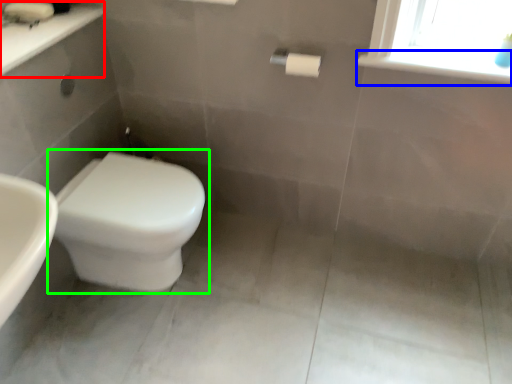
Question: Estimate the real-world distances between objects in this image. Which object is farther from counter top (highlighted by a red box), window sill (highlighted by a blue box) or toilet (highlighted by a green box)?

Choices:
 (A) window sill
 (B) toilet

Answer: (A)